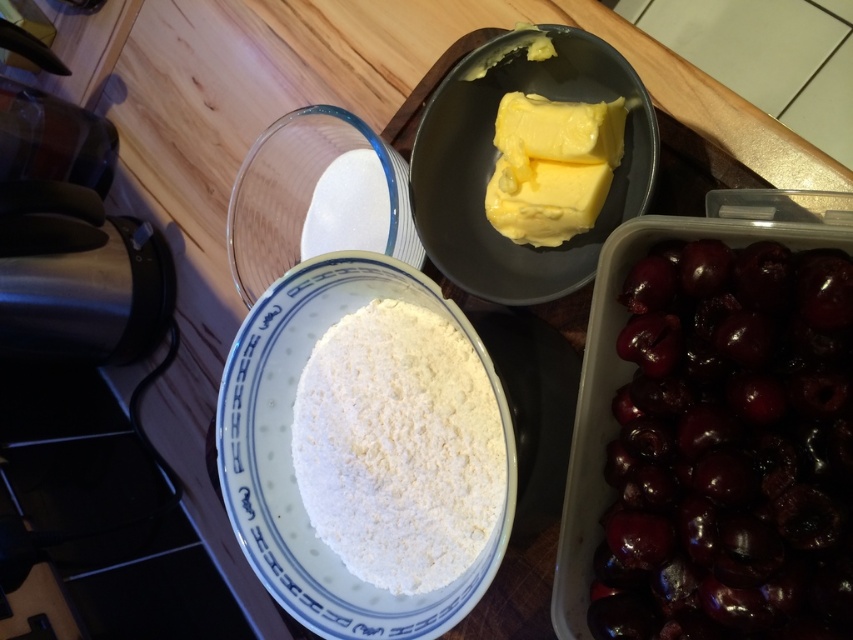
Question: Is white powdery flour at center positioned behind yellowish matte butter at upper center?

Choices:
 (A) yes
 (B) no

Answer: (A)

Question: Which object is farther from the camera taking this photo?

Choices:
 (A) white powdery flour at center
 (B) shiny dark red cherries at bottom right

Answer: (A)

Question: Is white powdery flour at center above yellowish matte butter at upper center?

Choices:
 (A) no
 (B) yes

Answer: (A)

Question: Can you confirm if shiny dark red cherries at bottom right is smaller than yellow creamy butter at upper center?

Choices:
 (A) yes
 (B) no

Answer: (B)

Question: Among these objects, which one is farthest from the camera?

Choices:
 (A) yellow creamy butter at upper center
 (B) yellowish matte butter at upper center
 (C) shiny dark red cherries at bottom right

Answer: (A)

Question: Estimate the real-world distances between objects in this image. Which object is farther from the yellow creamy butter at upper center?

Choices:
 (A) white powdery flour at center
 (B) yellowish matte butter at upper center
 (C) shiny dark red cherries at bottom right

Answer: (C)